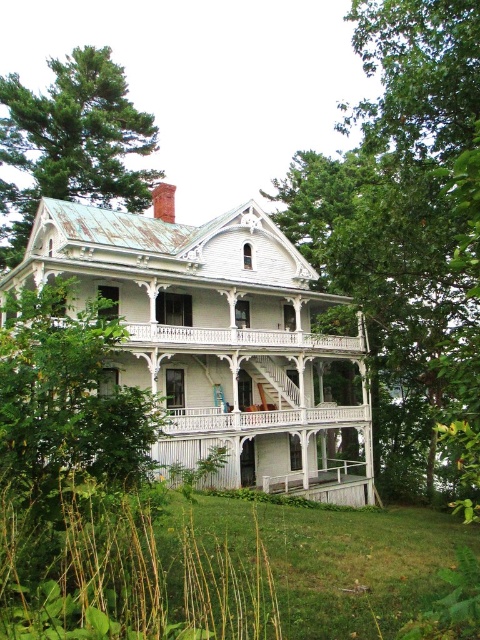
You are standing in front of the Victorian house and want to take a photo of the green leafy tree at center. Where should you position yourself to capture the tree in the frame?

The green leafy tree at center is located at point (406,228), so you should position yourself in front of the Victorian house facing towards the center area to capture the tree in the frame.

You are standing on the wraparound porch of the white Victorian house and want to determine which tree is closer to you. The two trees are the green leafy tree at center and the green leafy tree at upper left. Based on their sizes, which one is closer?

The green leafy tree at center is bigger than the green leafy tree at upper left, so the green leafy tree at center is closer to you because larger objects in the foreground appear bigger than those in the background.